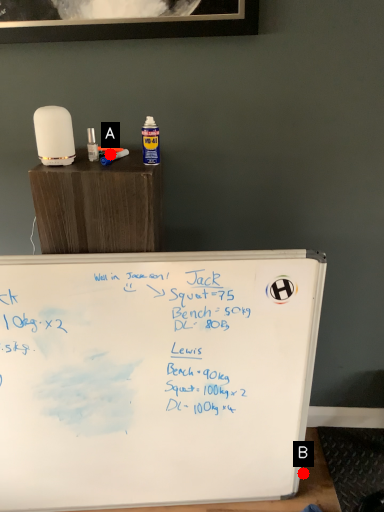
Question: Two points are circled on the image, labeled by A and B beside each circle. Which point is closer to the camera?

Choices:
 (A) A is closer
 (B) B is closer

Answer: (A)